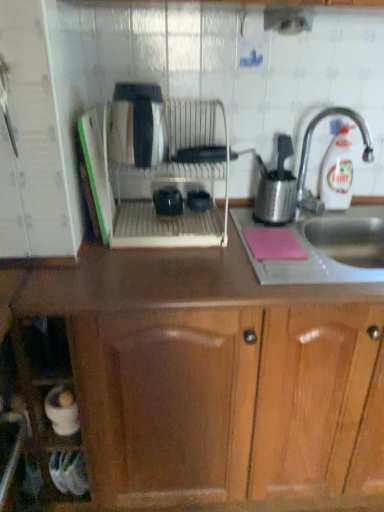
Find the location of `empty space that is to the right of black plastic bowls at center, which is the 2th appliance in left-to-right order`. empty space that is to the right of black plastic bowls at center, which is the 2th appliance in left-to-right order is located at coordinates (241, 215).